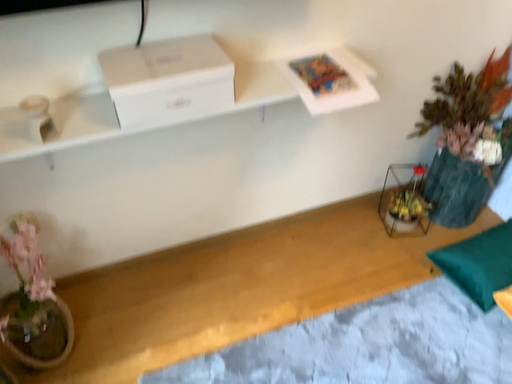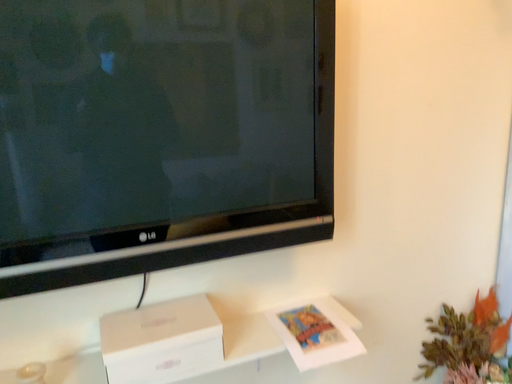
Question: Which way did the camera rotate in the video?

Choices:
 (A) rotated downward
 (B) rotated upward

Answer: (B)